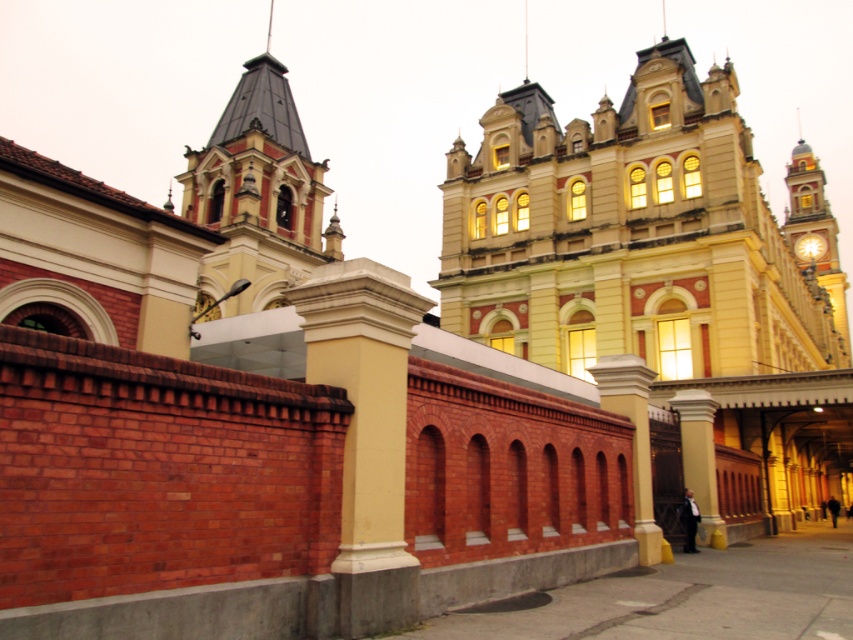
You are an architect analyzing the building facade. Which object, the matte red brick tower at upper left or the shiny metallic spire at upper center, would require more materials to construct due to its size?

The matte red brick tower at upper left requires more materials to construct because it has a larger size compared to the shiny metallic spire at upper center.

You are an architect analyzing the building layout. From your vantage point, which object is closer to you between the matte red brick tower at upper left and the shiny metallic spire at upper center?

The matte red brick tower at upper left is closer to you because it is positioned in front of the shiny metallic spire at upper center.

You are standing in front of the historic building and want to walk from the first point to the second point. Are you able to walk directly from point [302,225] to point [664,29] without any obstacles?

Point [302,225] is in front of point [664,29], so there is a clear path between them. You can walk directly from point [302,225] to point [664,29] without any obstacles.